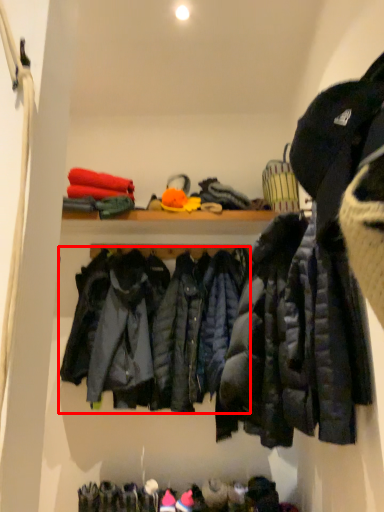
Question: Observing the image, what is the correct spatial positioning of jacket (annotated by the red box) in reference to jacket?

Choices:
 (A) left
 (B) right

Answer: (A)